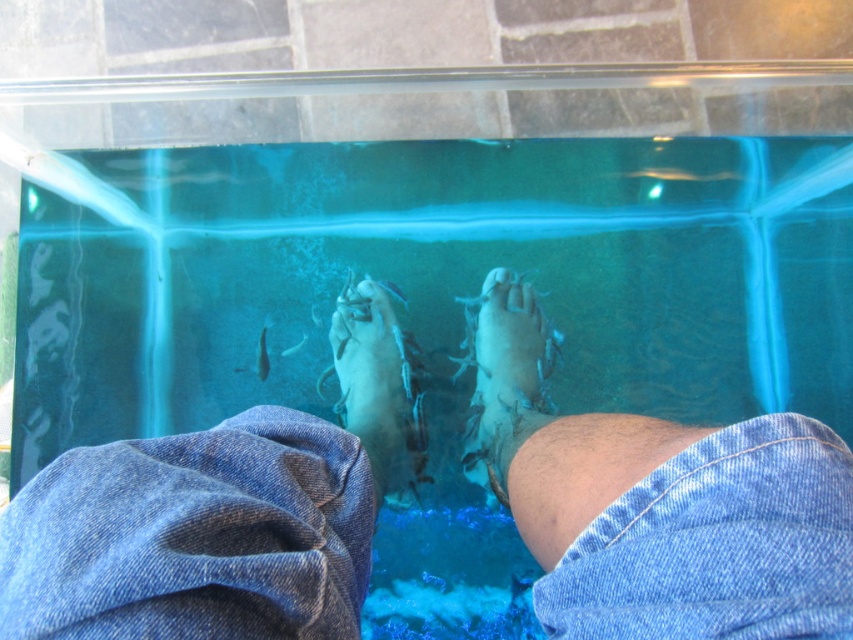
What do you see at coordinates (503, 372) in the screenshot? I see `white matte foot at center` at bounding box center [503, 372].

Does white matte foot at center appear over white matte fish spa at center?

Yes.

I want to click on white matte foot at center, so click(x=503, y=372).

Image resolution: width=853 pixels, height=640 pixels. Describe the element at coordinates (215, 516) in the screenshot. I see `denim at lower center` at that location.

Can you confirm if denim at lower center is wider than white matte fish spa at center?

Correct, the width of denim at lower center exceeds that of white matte fish spa at center.

Does point (239, 586) come behind point (363, 433)?

No.

I want to click on denim at lower center, so click(x=215, y=516).

Does denim at lower center have a smaller size compared to white matte foot at center?

No, denim at lower center is not smaller than white matte foot at center.

Who is more forward, (299,620) or (473,442)?

Point (299,620) is in front.

Locate an element on the screen. denim at lower center is located at coordinates (215, 516).